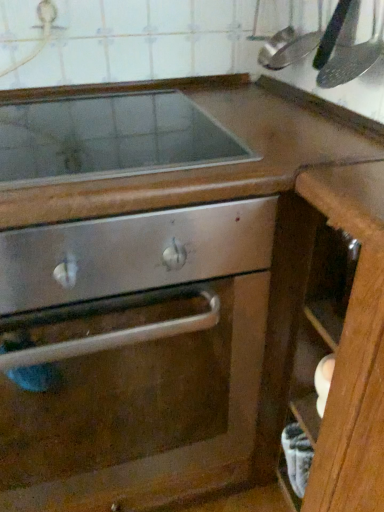
Where is `vacant area situated below smooth stainless steel cooktop at upper center (from a real-world perspective)`? vacant area situated below smooth stainless steel cooktop at upper center (from a real-world perspective) is located at coordinates (91, 134).